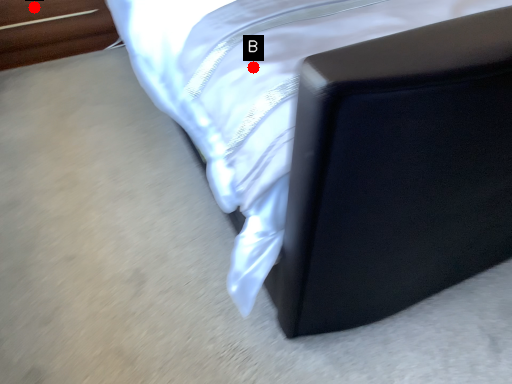
Question: Two points are circled on the image, labeled by A and B beside each circle. Which of the following is the closest to the observer?

Choices:
 (A) A is closer
 (B) B is closer

Answer: (B)